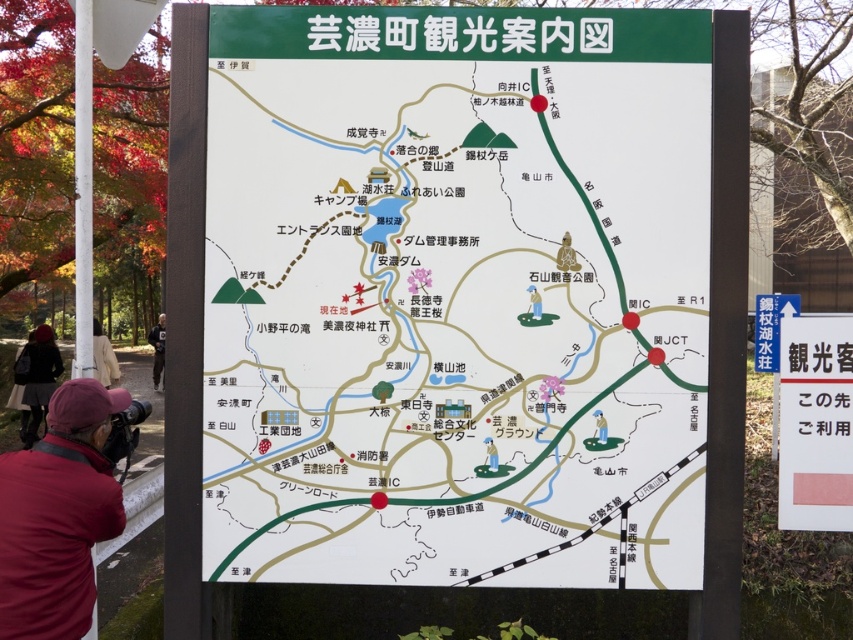
Question: Considering the real-world distances, which object is farthest from the dark gray jacket at left?

Choices:
 (A) white paper sign at upper right
 (B) beige fabric jacket at left
 (C) red fabric cap at lower left

Answer: (C)

Question: Can you confirm if white paper map at center is positioned below red fabric cap at lower left?

Choices:
 (A) no
 (B) yes

Answer: (A)

Question: Considering the relative positions of white paper map at center and red fabric cap at lower left in the image provided, where is white paper map at center located with respect to red fabric cap at lower left?

Choices:
 (A) below
 (B) above

Answer: (B)

Question: Which object appears closest to the camera in this image?

Choices:
 (A) red fabric cap at lower left
 (B) matte white statue at center
 (C) green plastic figure at center-right

Answer: (A)

Question: Which point is closer to the camera taking this photo?

Choices:
 (A) (93, 401)
 (B) (163, 336)

Answer: (A)

Question: Is green plastic figure at center-right wider than matte white statue at center?

Choices:
 (A) yes
 (B) no

Answer: (B)